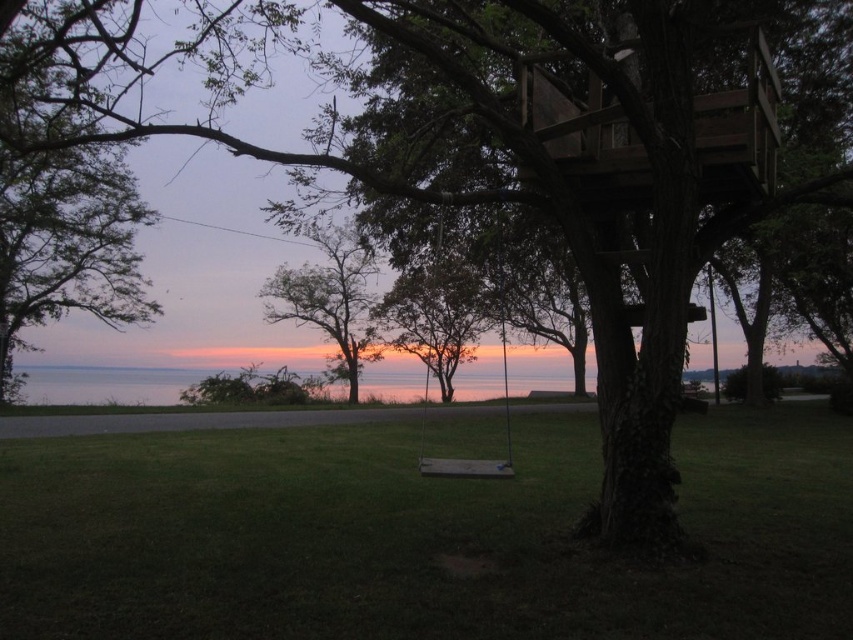
Can you confirm if green leafy tree at center is positioned below smooth bark tree at center?

Incorrect, green leafy tree at center is not positioned below smooth bark tree at center.

Measure the distance between point (x=386, y=324) and camera.

Point (x=386, y=324) and camera are 122.00 feet apart from each other.

The width and height of the screenshot is (853, 640). In order to click on green leafy tree at center in this screenshot , I will do `click(437, 308)`.

Between point (292, 296) and point (498, 477), which one is positioned in front?

Point (498, 477) is more forward.

Does point (369, 266) come farther from viewer compared to point (447, 470)?

Yes, point (369, 266) is behind point (447, 470).

The height and width of the screenshot is (640, 853). In order to click on smooth bark tree at center in this screenshot , I will do `click(329, 298)`.

At what (x,y) coordinates should I click in order to perform the action: click on smooth bark tree at center. Please return your answer as a coordinate pair (x, y). This screenshot has width=853, height=640. Looking at the image, I should click on (329, 298).

Is green grass at center closer to camera compared to wooden swing at center?

Yes, it is.

Who is shorter, green grass at center or wooden swing at center?

green grass at center is shorter.

Is point (16, 632) more distant than point (485, 476)?

No, (16, 632) is closer to viewer.

This screenshot has height=640, width=853. I want to click on green grass at center, so pyautogui.click(x=418, y=536).